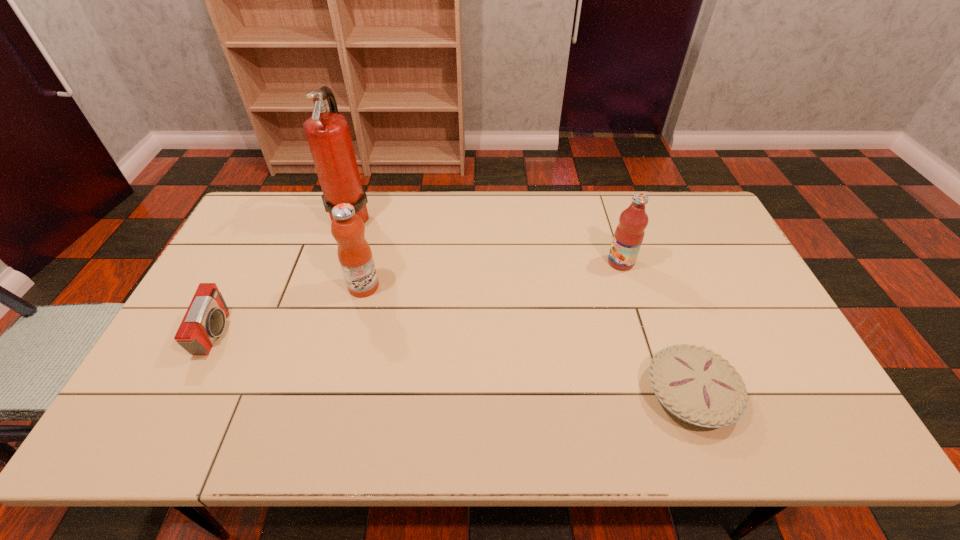
Where is `vacant area situated 0.350m on the front label of the left fruit juice`? vacant area situated 0.350m on the front label of the left fruit juice is located at coordinates (497, 287).

Find the location of a particular element. The height and width of the screenshot is (540, 960). vacant space situated 0.320m on the front label of the shorter fruit juice is located at coordinates (505, 262).

You are a GUI agent. You are given a task and a screenshot of the screen. Output one action in this format:
    pyautogui.click(x=<x>, y=<y>)
    Task: Click on the free space located 0.310m on the front label of the shorter fruit juice
    This screenshot has width=960, height=540.
    Given the screenshot: What is the action you would take?
    coord(508,262)

Find the location of a particular element. vacant region located 0.280m on the front label of the shorter fruit juice is located at coordinates (517, 262).

Locate an element on the screen. The image size is (960, 540). vacant space located on the front-facing side of the fourth tallest object is located at coordinates (278, 333).

The width and height of the screenshot is (960, 540). Identify the location of vacant space located 0.110m on the back of the shortest object. (664, 322).

Locate an element on the screen. object situated at the far edge is located at coordinates (328, 135).

Image resolution: width=960 pixels, height=540 pixels. What are the coordinates of `object at the near edge` in the screenshot? It's located at (696, 385).

Image resolution: width=960 pixels, height=540 pixels. Identify the location of object present at the left edge. (205, 319).

The image size is (960, 540). What are the coordinates of `free space at the far edge of the desktop` in the screenshot? It's located at (467, 228).